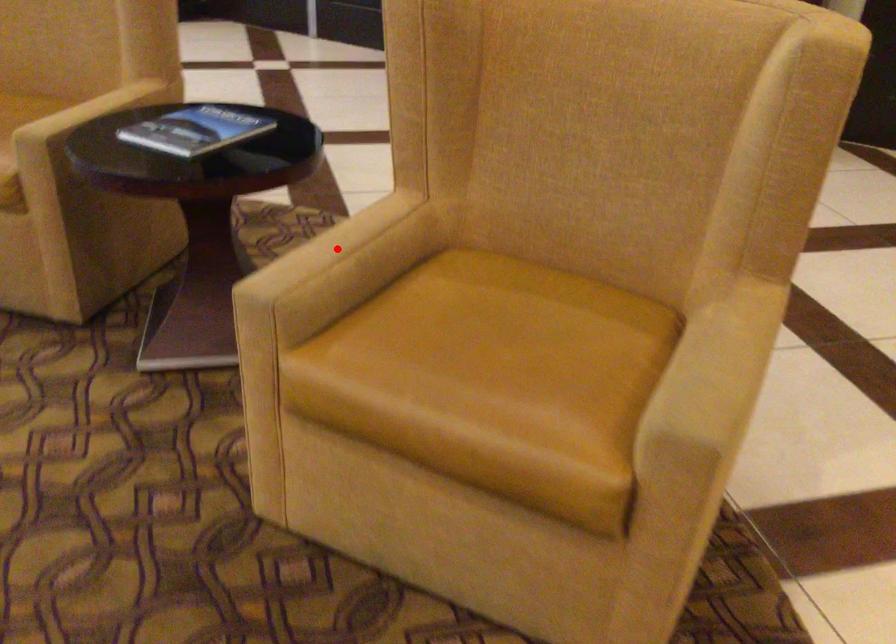
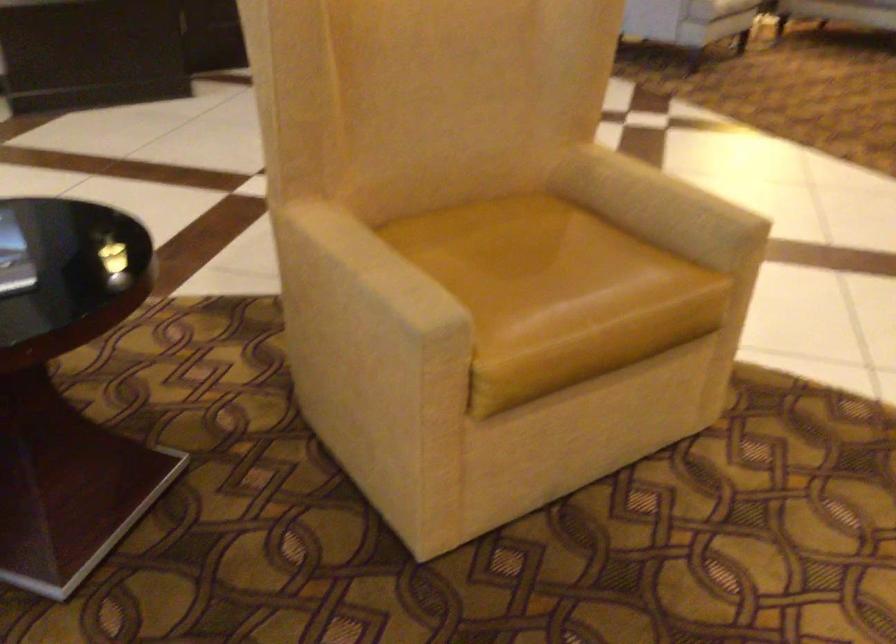
Where in the second image is the point corresponding to the highlighted location from the first image?

(375, 266)